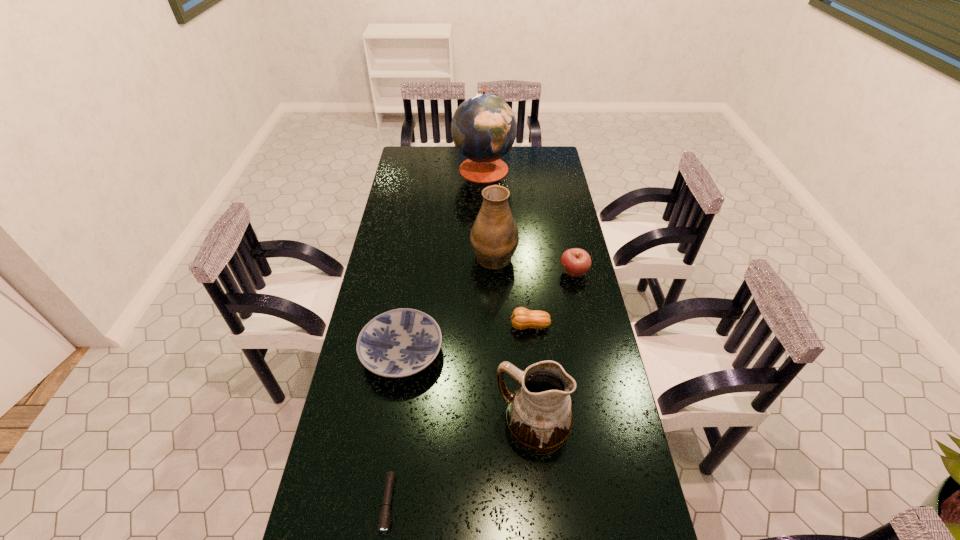
Where is `vacant space in between the nearer pitcher and the farther pitcher`? vacant space in between the nearer pitcher and the farther pitcher is located at coordinates (514, 341).

Locate an element on the screen. free point between the rightmost object and the farther pitcher is located at coordinates (534, 264).

Find the location of a particular element. This screenshot has width=960, height=540. the fourth closest object to the nearest object is located at coordinates (494, 238).

Identify which object is the third closest to the farther pitcher. Please provide its 2D coordinates. Your answer should be formatted as a tuple, i.e. [(x, y)], where the tuple contains the x and y coordinates of a point satisfying the conditions above.

[(398, 343)]

I want to click on free space that satisfies the following two spatial constraints: 1. with the Americas facing the viewer on the farthest object; 2. at the lens end of the shortest object, so click(x=488, y=503).

Image resolution: width=960 pixels, height=540 pixels. Identify the location of vacant space that satisfies the following two spatial constraints: 1. with the Americas facing the viewer on the tallest object; 2. on the handle side of the farther pitcher. (485, 255).

The width and height of the screenshot is (960, 540). I want to click on free spot that satisfies the following two spatial constraints: 1. with the Americas facing the viewer on the farthest object; 2. on the front side of the plate, so click(x=486, y=353).

Identify the location of vacant space that satisfies the following two spatial constraints: 1. with the Americas facing the viewer on the globe; 2. at the lens end of the flashlight. (488, 503).